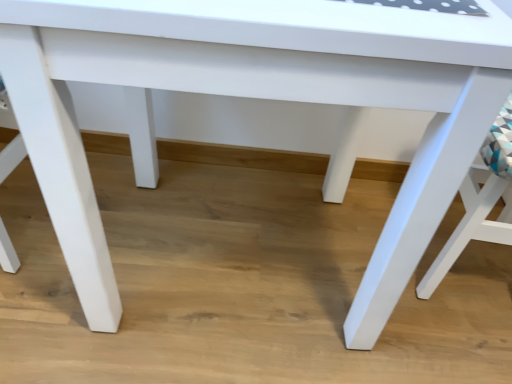
Locate an element on the screen. This screenshot has width=512, height=384. free region under white glossy swivel chair at lower right (from a real-world perspective) is located at coordinates (478, 281).